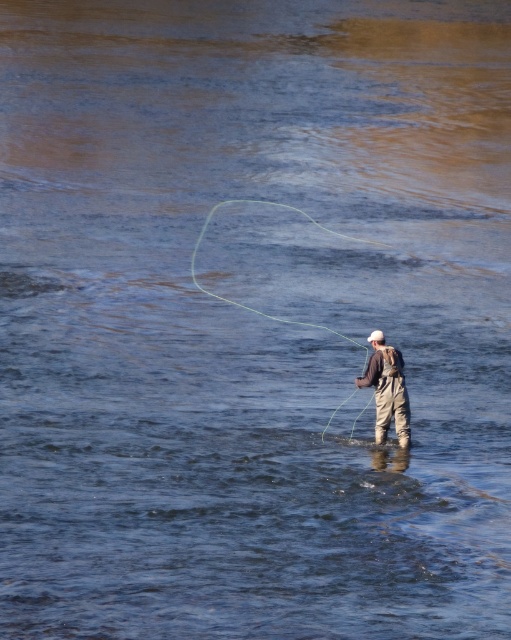
You are a fly fishing enthusiast who wants to ensure your gear is properly arranged. You have khaki waterproof waders at center and a green rubber string at center. Which item takes up more space?

The green rubber string at center takes up more space than the khaki waterproof waders at center because the khaki waterproof waders at center is smaller than the green rubber string at center.

You are planning to join the person in the image for fly fishing. You need to position yourself so that you are directly behind the khaki waterproof waders at center. What coordinates should you aim for to ensure you are directly behind them?

To position yourself directly behind the khaki waterproof waders at center located at coordinates point (387, 388), you should aim for coordinates slightly higher on the y axis, such as point (434, 388) to be directly behind.